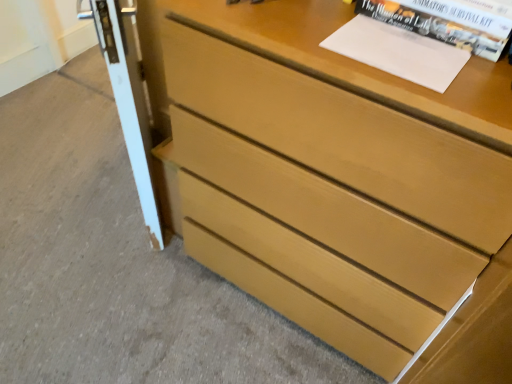
Locate an element on the screen. The image size is (512, 384). free space in front of white paper at upper right is located at coordinates (423, 91).